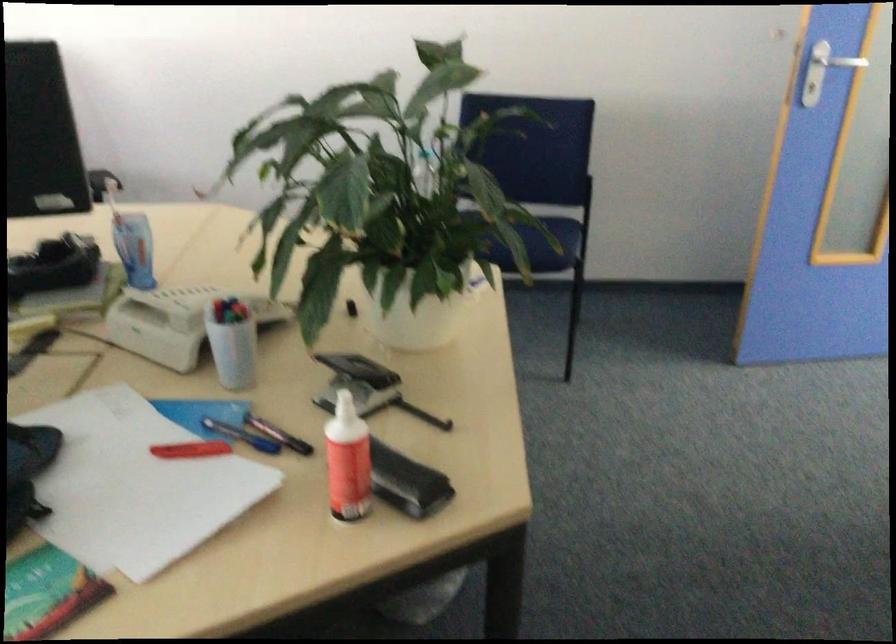
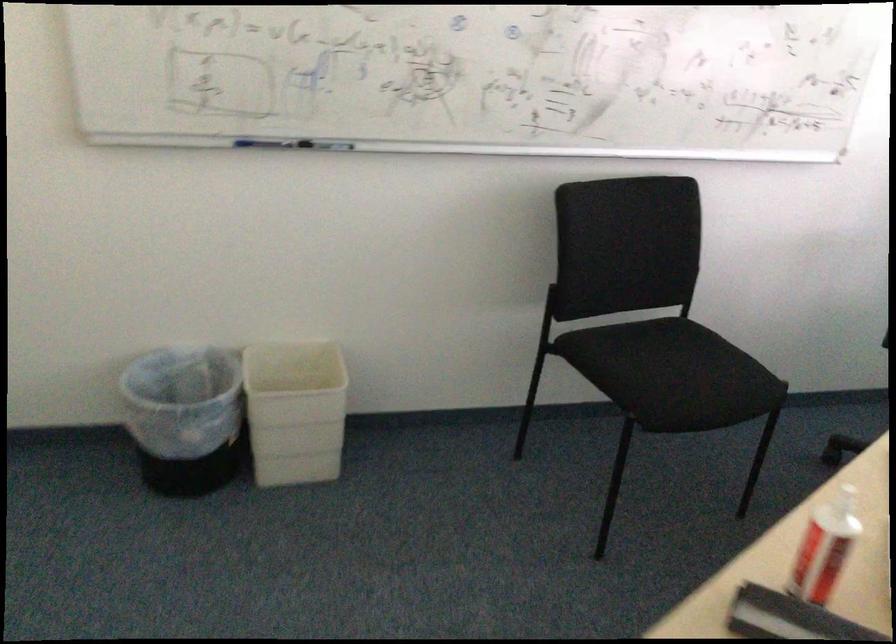
Find the pixel in the second image that matches point (214, 500) in the first image.

(824, 547)